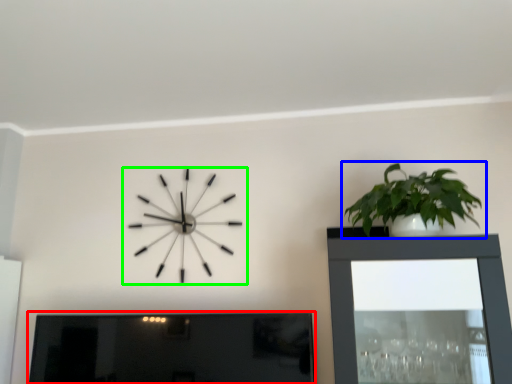
Question: Which object is the farthest from picture frame (highlighted by a red box)? Choose among these: houseplant (highlighted by a blue box) or wall clock (highlighted by a green box).

Choices:
 (A) houseplant
 (B) wall clock

Answer: (A)